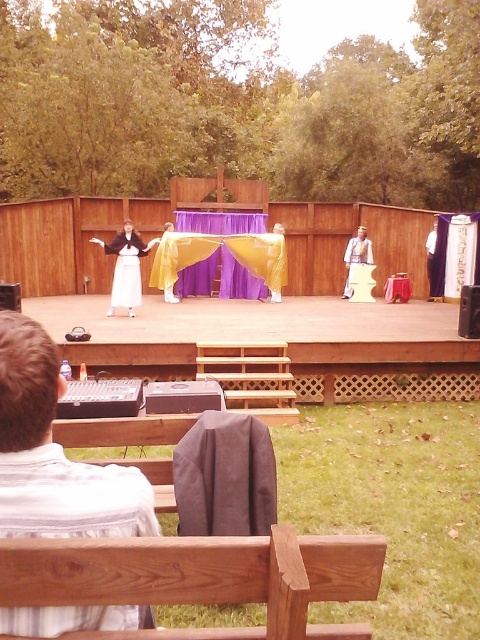
You are a photographer trying to capture a clear shot of the striped cotton shirt at lower left and the purple velvet curtain at center. Since you can only focus on one object at a time, which one should you choose to ensure the other is still in the background?

You should focus on the striped cotton shirt at lower left because it is closer to the viewer than the purple velvet curtain at center, so if you focus on it, the curtain will naturally be in the background.

You are an audience member sitting at the point labeled point [133,250]. You want to see the performer who is standing at point [360,236]. Is there any obstruction between you and that performer?

Point [133,250] is in front of point [360,236], so there is no obstruction between you and the performer at point [360,236].

You are a photographer at the back of the audience, and you want to take a picture of the white satin dress at center and the light brown leather jacket at center. Which one is positioned to the left side of the other?

The white satin dress at center is to the left of the light brown leather jacket at center.